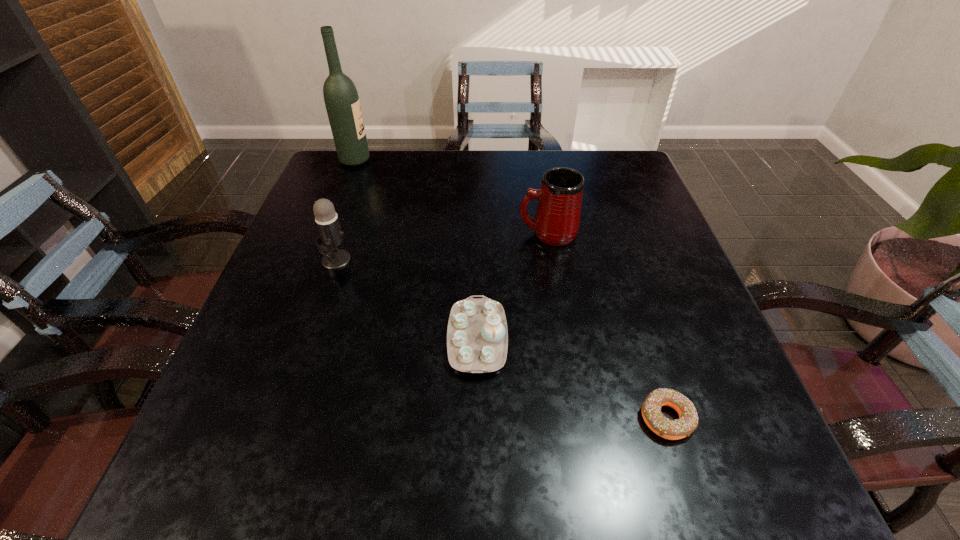
Identify the location of wine bottle. This screenshot has width=960, height=540. (341, 98).

This screenshot has height=540, width=960. Find the location of `the farthest object`. the farthest object is located at coordinates (341, 98).

Where is `microphone`? microphone is located at coordinates 331,236.

You are a GUI agent. You are given a task and a screenshot of the screen. Output one action in this format:
    pyautogui.click(x=<x>, y=<y>)
    Task: Click on the second object from right to left
    The image size is (960, 540).
    Given the screenshot: What is the action you would take?
    pyautogui.click(x=557, y=219)

Find the location of `mug`. mug is located at coordinates (557, 219).

At what (x,y) coordinates should I click in order to perform the action: click on the fourth farthest object. Please return your answer as a coordinate pair (x, y). Looking at the image, I should click on (477, 336).

The image size is (960, 540). Find the location of `chinaware`. chinaware is located at coordinates (477, 336).

I want to click on doughnut, so click(687, 422).

Locate an element on the screen. the nearest object is located at coordinates (687, 422).

Identify the location of vacant area situated on the labeled side of the tallest object. 395,160.